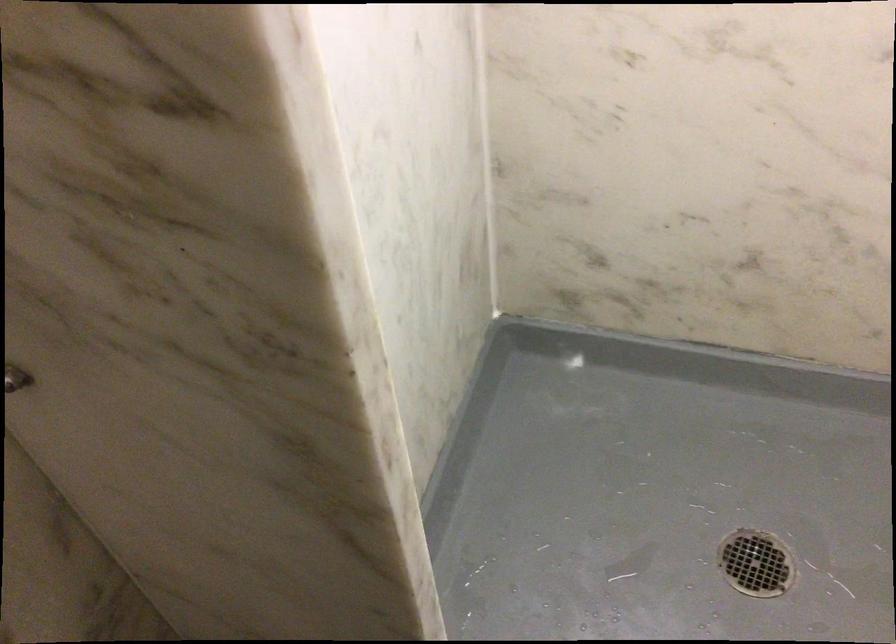
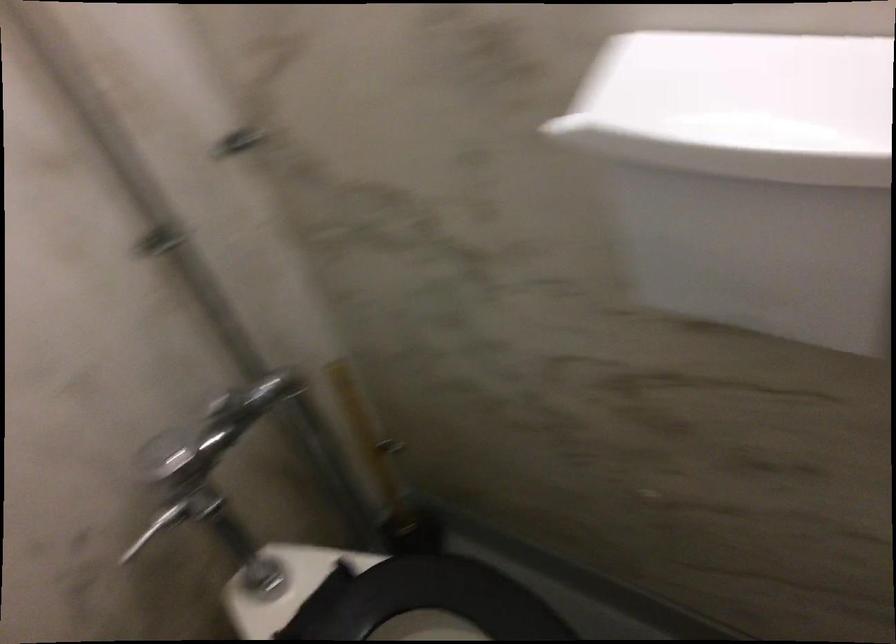
Question: The camera is either moving clockwise (left) or counter-clockwise (right) around the object. The first image is from the beginning of the video and the second image is from the end. Is the camera moving left or right when shooting the video?

Choices:
 (A) Left
 (B) Right

Answer: (A)